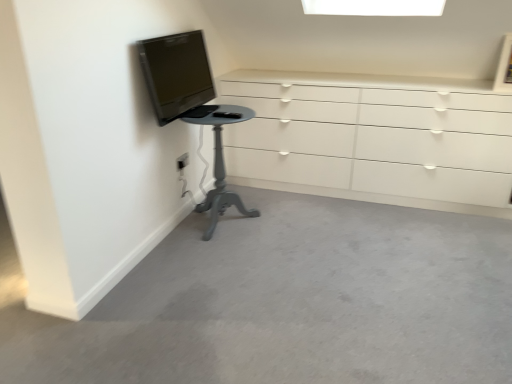
Question: In the image, is white glossy chest of drawers at upper right positioned in front of or behind matte black tv at upper left?

Choices:
 (A) front
 (B) behind

Answer: (B)

Question: Does point 270,148 appear closer or farther from the camera than point 161,119?

Choices:
 (A) farther
 (B) closer

Answer: (A)

Question: Estimate the real-world distances between objects in this image. Which object is farther from the white plastic electric outlet at lower left?

Choices:
 (A) matte black tv at upper left
 (B) white glossy chest of drawers at upper right
 (C) matte gray pedestal table at lower left

Answer: (B)

Question: Estimate the real-world distances between objects in this image. Which object is farther from the white plastic electric outlet at lower left?

Choices:
 (A) matte black tv at upper left
 (B) matte gray pedestal table at lower left
 (C) white glossy chest of drawers at upper right

Answer: (C)